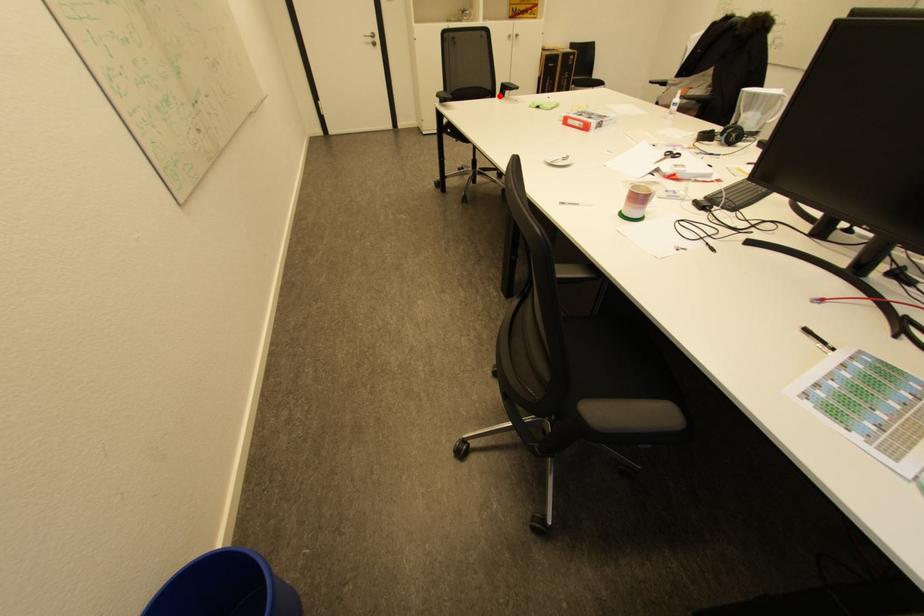
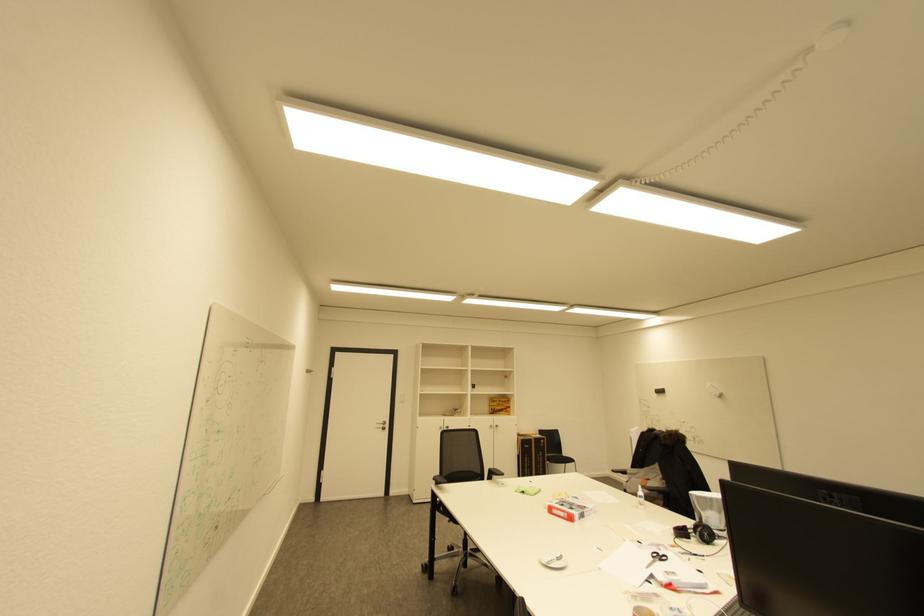
Question: I am providing you with two images of the same scene from different viewpoints. In image1, a red point is highlighted. Considering the same 3D point in image2, which of the following is correct?

Choices:
 (A) It is closer
 (B) It is farther

Answer: (B)